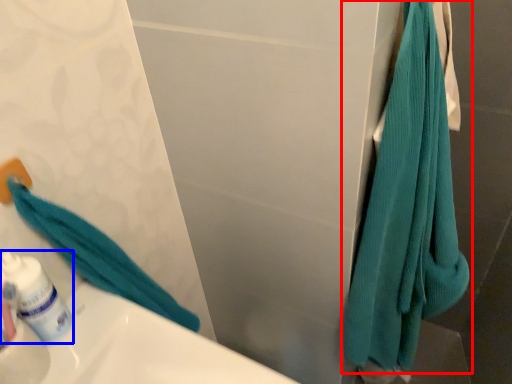
Question: Which point is closer to the camera, towel (highlighted by a red box) or mouthwash (highlighted by a blue box)?

Choices:
 (A) towel
 (B) mouthwash

Answer: (A)